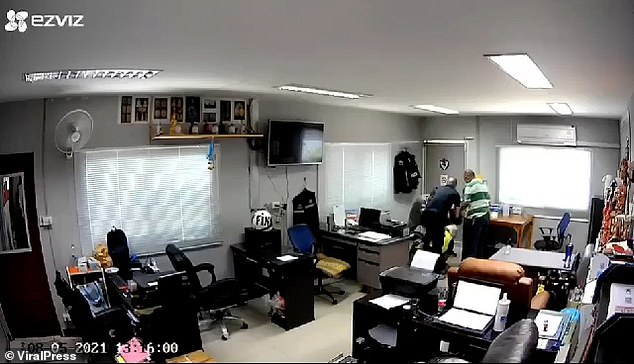
I want to click on floor, so click(x=317, y=338).